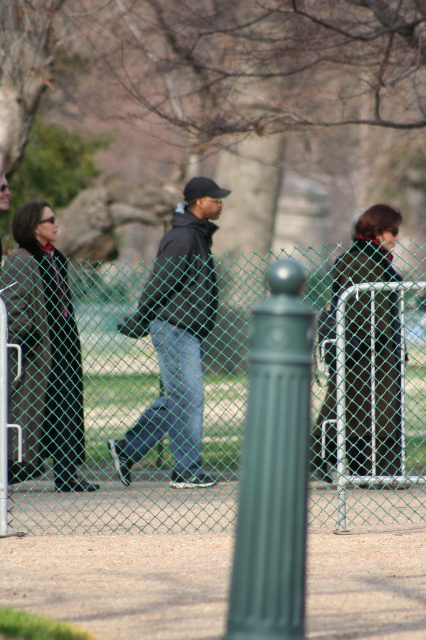
Question: Does green matte pole at center have a greater width compared to dark brown leather jacket at center?

Choices:
 (A) no
 (B) yes

Answer: (A)

Question: Does green matte pole at center have a lesser width compared to dark blue jeans at center?

Choices:
 (A) yes
 (B) no

Answer: (A)

Question: Which point is closer to the camera taking this photo?

Choices:
 (A) (78, 432)
 (B) (365, 390)
 (C) (106, 307)
 (D) (271, 634)

Answer: (D)

Question: Considering the real-world distances, which object is closest to the green chain-link fence at center?

Choices:
 (A) dark brown leather coat at left
 (B) green matte pole at center
 (C) dark brown leather jacket at center
 (D) dark blue jeans at center

Answer: (C)

Question: Which point appears closest to the camera in this image?

Choices:
 (A) (181, 268)
 (B) (284, 328)
 (C) (314, 412)
 (D) (367, 308)

Answer: (B)

Question: Is green matte pole at center in front of dark brown leather jacket at center?

Choices:
 (A) no
 (B) yes

Answer: (B)